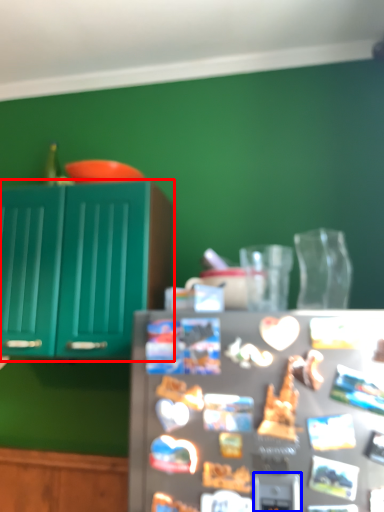
Question: Which of the following is the farthest to the observer, cabinetry (highlighted by a red box) or appliance (highlighted by a blue box)?

Choices:
 (A) cabinetry
 (B) appliance

Answer: (A)